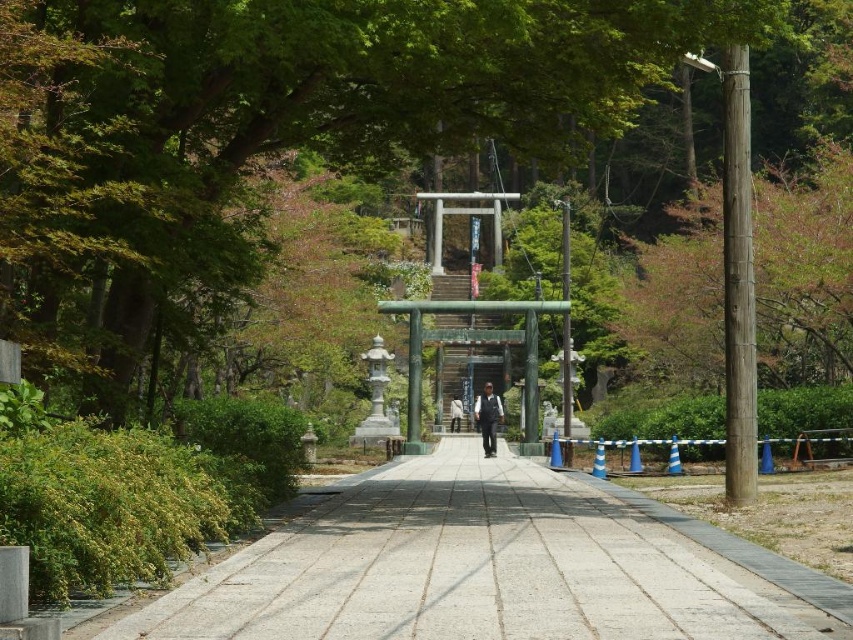
From the picture: You are a tourist walking along the pathway towards the torii gate. You have a black fabric jacket at center that you want to lay flat on the gray concrete pavement at center. Will the pavement be wide enough to accommodate the jacket without any part hanging off the edge?

The gray concrete pavement at center is wider than the black fabric jacket at center. Therefore, the pavement is wide enough to lay the jacket flat without any part hanging off the edge.

You are a hiker carrying a 3 meter long bamboo pole horizontally. You are standing at the start of the pathway and see the green leafy tree at center. Can you walk towards the tree while keeping the pole horizontal without hitting anything?

The distance between you and the green leafy tree at center is 10.77 meters. Since the bamboo pole is only 3 meters long, you have enough space to walk towards the tree while keeping the pole horizontal without any obstruction.